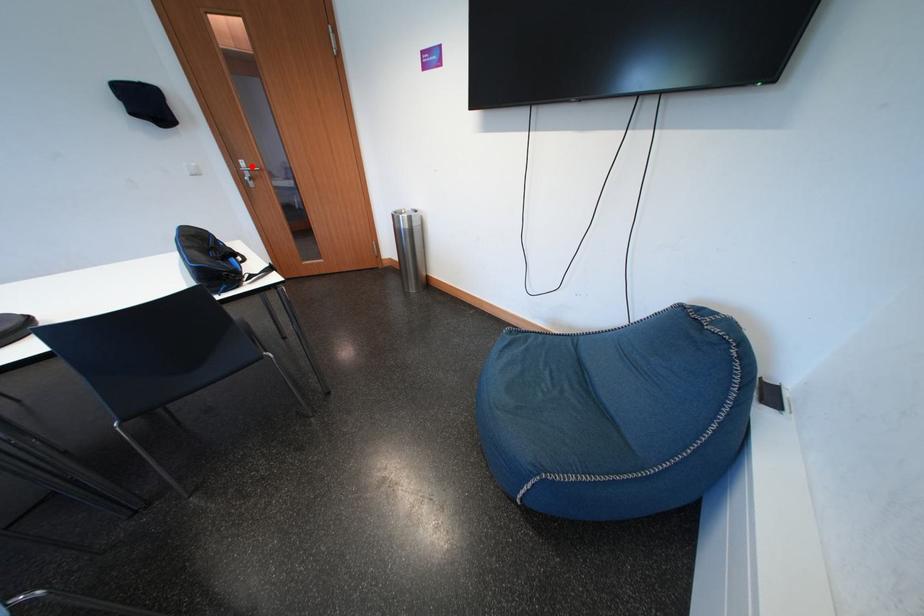
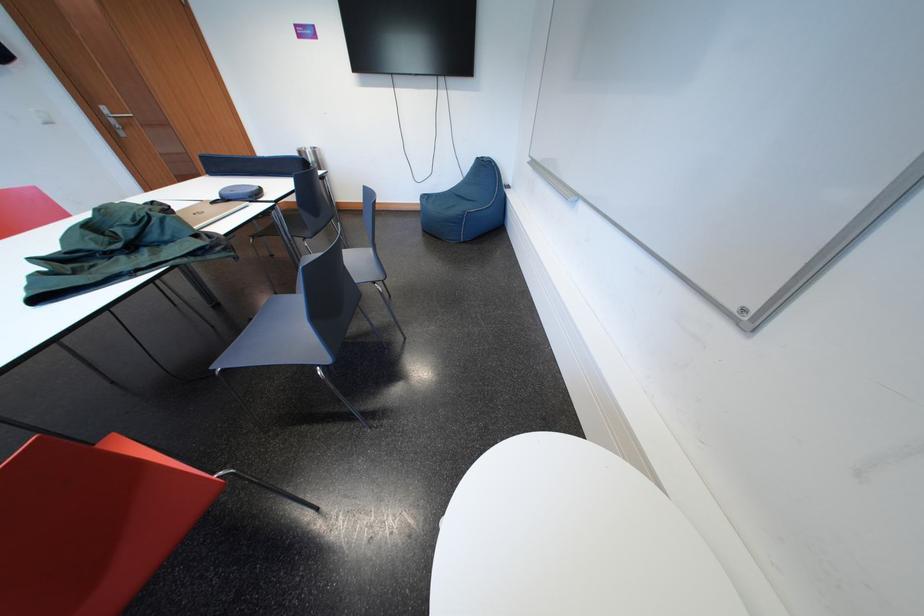
Question: I am providing you with two images of the same scene from different viewpoints. Given a red point in image1, look at the same physical point in image2. Is it:

Choices:
 (A) Closer to the viewpoint
 (B) Farther from the viewpoint

Answer: (B)